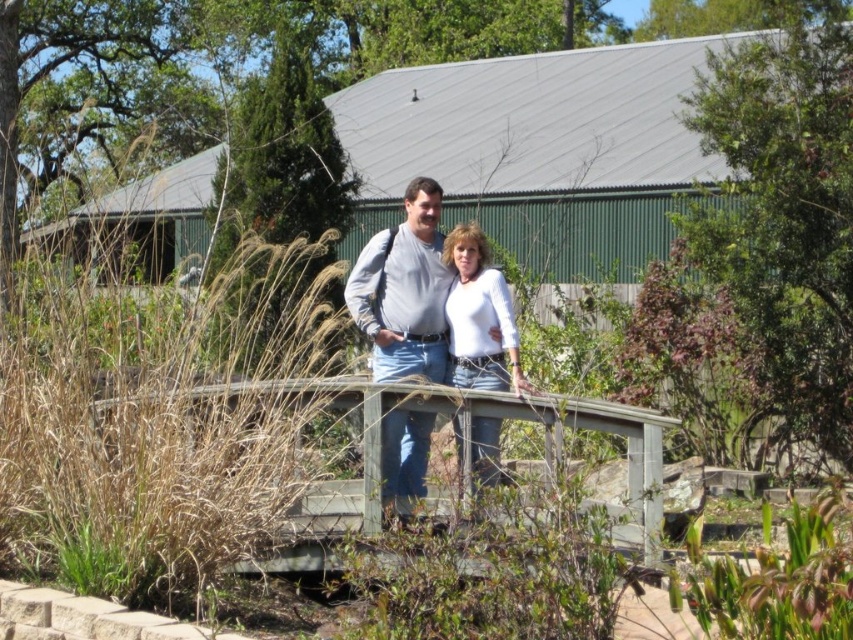
How distant is matte gray shirt at center from white matte shirt at center?

The distance of matte gray shirt at center from white matte shirt at center is 41.15 centimeters.

Find the location of a particular element. Image resolution: width=853 pixels, height=640 pixels. matte gray shirt at center is located at coordinates (404, 291).

Does wooden rail at center have a greater height compared to matte gray shirt at center?

No, wooden rail at center is not taller than matte gray shirt at center.

Does wooden rail at center have a greater width compared to matte gray shirt at center?

Indeed, wooden rail at center has a greater width compared to matte gray shirt at center.

Between point (202, 388) and point (434, 312), which one is positioned behind?

Positioned behind is point (434, 312).

Identify the location of wooden rail at center. The width and height of the screenshot is (853, 640). (466, 452).

Does wooden rail at center appear on the left side of white matte shirt at center?

Yes, wooden rail at center is to the left of white matte shirt at center.

Who is more forward, (152, 396) or (495, 451)?

Point (152, 396) is in front.

Between point (376, 429) and point (523, 378), which one is positioned in front?

Point (376, 429) is in front.

The height and width of the screenshot is (640, 853). What are the coordinates of `wooden rail at center` in the screenshot? It's located at (466, 452).